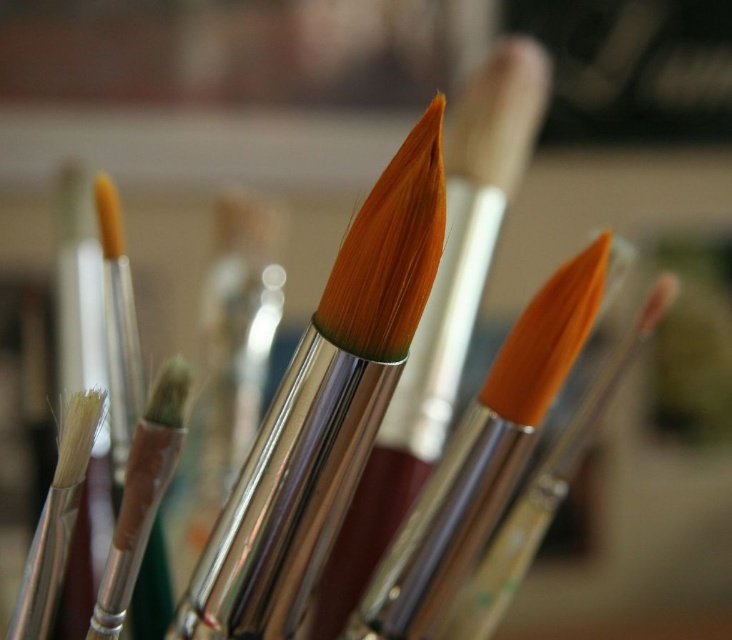
Question: From the image, what is the correct spatial relationship of orange matte paint brush at center in relation to orange metallic paint brush at center?

Choices:
 (A) above
 (B) below

Answer: (A)

Question: Does orange-bristled paintbrush at center appear on the right side of translucent plastic paint brush at center?

Choices:
 (A) yes
 (B) no

Answer: (A)

Question: Which object appears closest to the camera in this image?

Choices:
 (A) translucent plastic paint brush at center
 (B) white soft bristles at left
 (C) orange matte paint brush at center

Answer: (A)

Question: Does orange matte paint brush at center have a smaller size compared to white soft bristles at left?

Choices:
 (A) yes
 (B) no

Answer: (B)

Question: Which object is farther from the camera taking this photo?

Choices:
 (A) orange-bristled paintbrush at center
 (B) orange metallic paint brush at center
 (C) white soft bristles at left

Answer: (B)

Question: Estimate the real-world distances between objects in this image. Which object is farther from the orange-bristled paintbrush at center?

Choices:
 (A) orange matte paint brush at center
 (B) translucent plastic paint brush at center

Answer: (A)